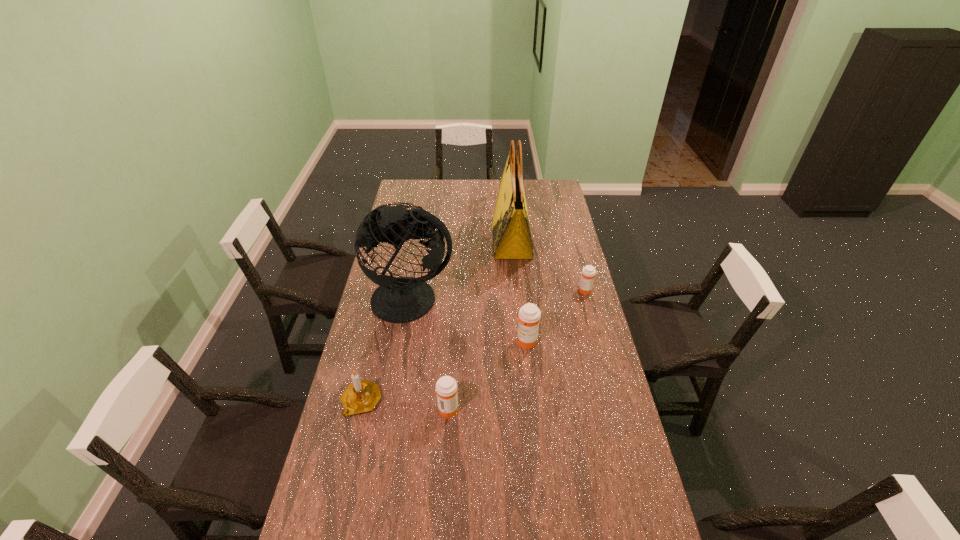
The medicines are evenly distributed in the image. To maintain this, where would you place another medicine on the left? Please point to a free space. Please provide its 2D coordinates. Your answer should be formatted as a tuple, i.e. [(x, y)], where the tuple contains the x and y coordinates of a point satisfying the conditions above.

[(344, 497)]